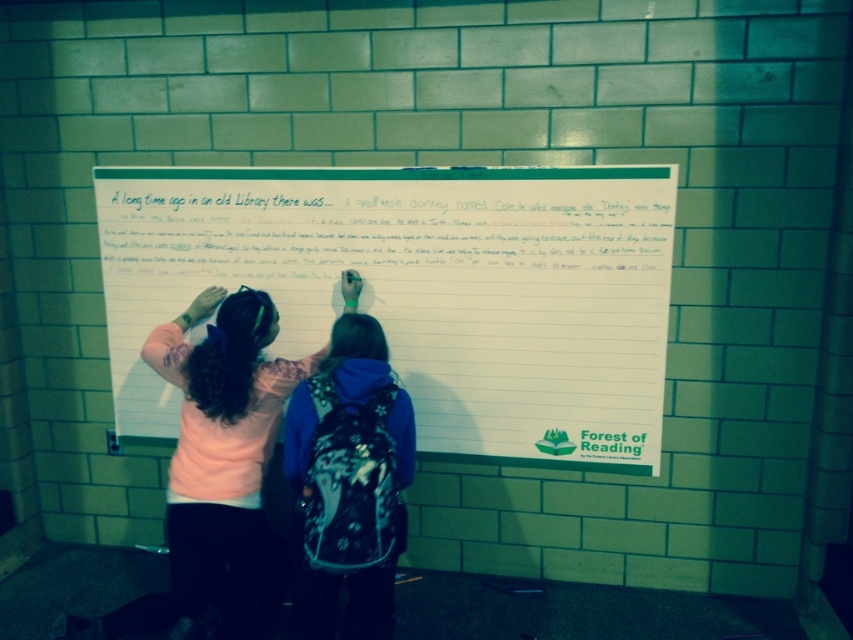
Question: Estimate the real-world distances between objects in this image. Which object is closer to the light pink sweater at center?

Choices:
 (A) floral-patterned backpack at center
 (B) white paper at center

Answer: (A)

Question: Considering the real-world distances, which object is farthest from the floral-patterned backpack at center?

Choices:
 (A) white paper at center
 (B) light pink sweater at center

Answer: (A)

Question: Which point is farther from the camera taking this photo?

Choices:
 (A) (473, 349)
 (B) (259, 456)

Answer: (A)

Question: In this image, where is white paper at center located relative to light pink sweater at center?

Choices:
 (A) above
 (B) below

Answer: (A)

Question: Does light pink sweater at center come in front of floral-patterned backpack at center?

Choices:
 (A) yes
 (B) no

Answer: (B)

Question: Can you confirm if white paper at center is thinner than light pink sweater at center?

Choices:
 (A) yes
 (B) no

Answer: (B)